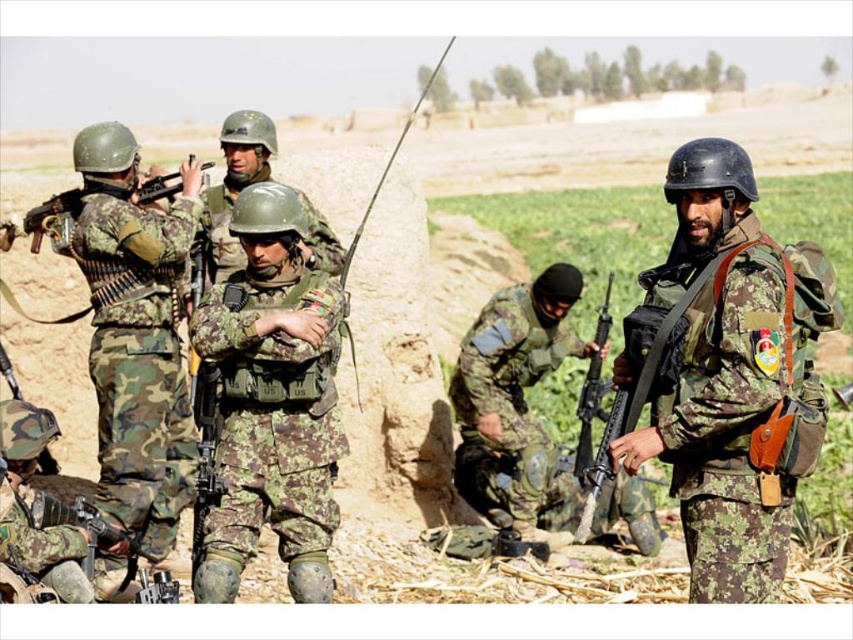
You are a military analyst reviewing this image of soldiers in a desert. You need to determine the spatial relationship between the two rifles labeled as camouflage fabric rifle at center and camouflage fabric rifle at lower left. Which rifle is positioned higher in the image?

The camouflage fabric rifle at center is positioned higher than the camouflage fabric rifle at lower left because it is described as being above it.

You are a drone operator trying to identify two specific points in the image. The first point is at coordinate point (471, 499) and the second is at point (169, 193). Which of these two points is closer to the camera?

Point (169, 193) is closer to the camera than point (471, 499) because the description states that point (471, 499) is further away.

You are a photographer standing 10 feet away from the camouflage fabric uniform at right. Can you take a clear photo of it without moving closer?

A: The camouflage fabric uniform at right is 13.86 feet away from the viewer. Since you are 10 feet away, you are closer than the described distance, so you can take a clear photo without moving closer.